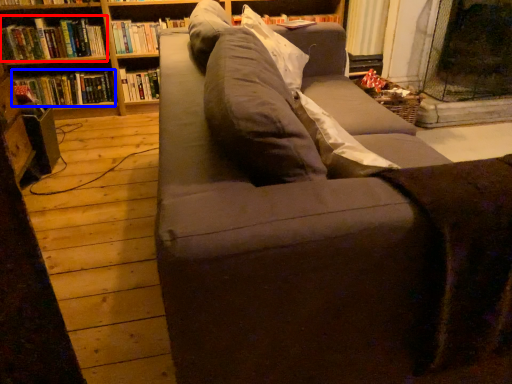
Question: Which object is closer to the camera taking this photo, book (highlighted by a red box) or book (highlighted by a blue box)?

Choices:
 (A) book
 (B) book

Answer: (A)